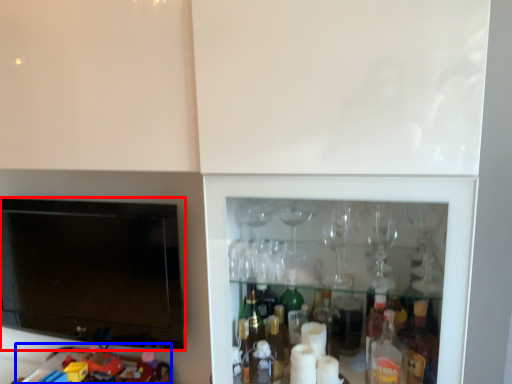
Question: Which of the following is the closest to the observer, television (highlighted by a red box) or toy (highlighted by a blue box)?

Choices:
 (A) television
 (B) toy

Answer: (B)